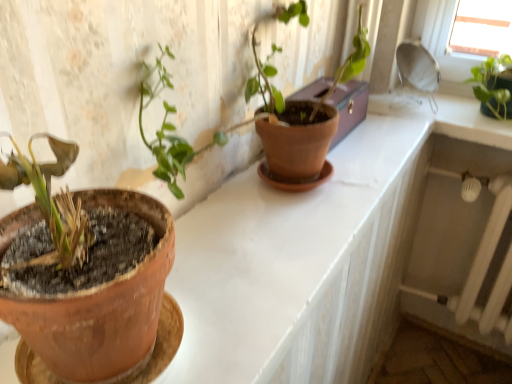
Question: Which is correct: matte terracotta pot at center is inside terracotta clay pot at left, or outside of it?

Choices:
 (A) outside
 (B) inside

Answer: (A)

Question: From a real-world perspective, relative to terracotta clay pot at left, is matte terracotta pot at center vertically above or below?

Choices:
 (A) below
 (B) above

Answer: (A)

Question: Which is nearer to the green matte plant at upper right?

Choices:
 (A) terracotta clay pot at left
 (B) brown leather box at upper center
 (C) matte terracotta pot at center

Answer: (B)

Question: Based on their relative distances, which object is farther from the brown leather box at upper center?

Choices:
 (A) terracotta clay pot at left
 (B) matte terracotta pot at center
 (C) green matte plant at upper right

Answer: (A)